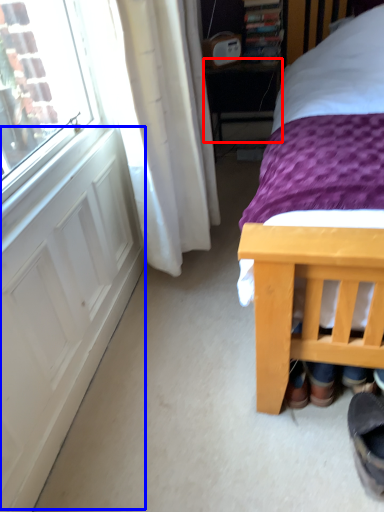
Question: Which point is further to the camera, table (highlighted by a red box) or screen door (highlighted by a blue box)?

Choices:
 (A) table
 (B) screen door

Answer: (A)